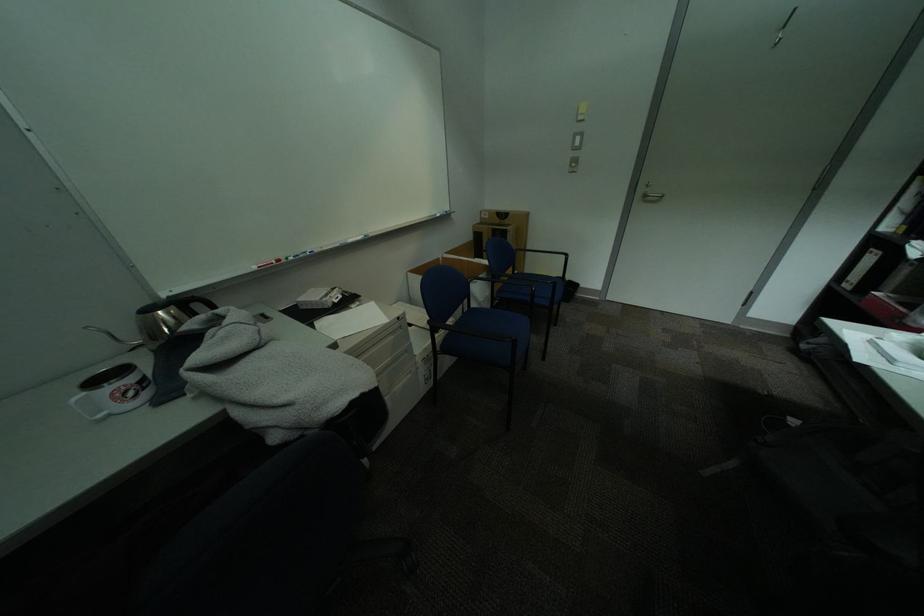
The width and height of the screenshot is (924, 616). What do you see at coordinates (650, 193) in the screenshot?
I see `the silver door handle` at bounding box center [650, 193].